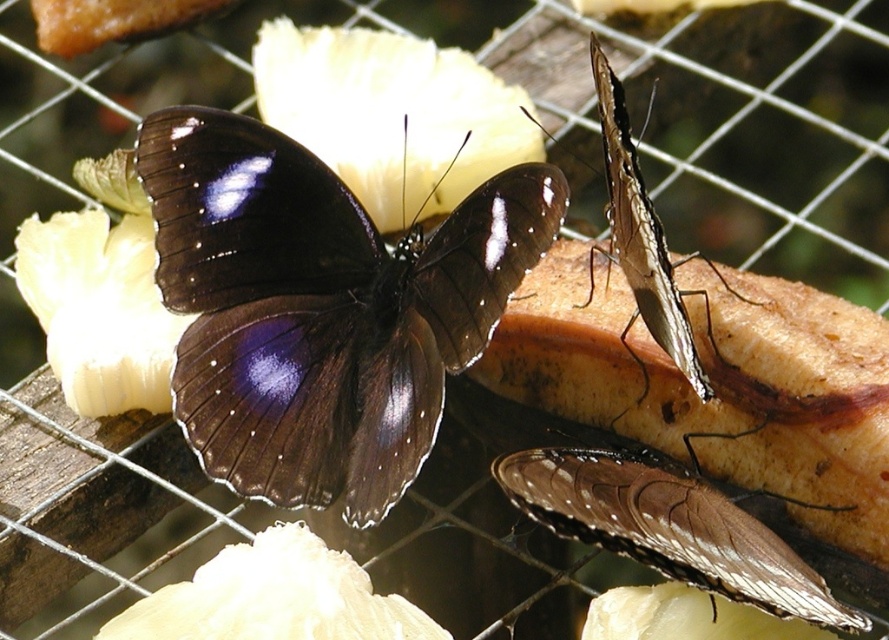
Question: Can you confirm if matte brown wing at center is bigger than shiny brown butterfly at upper right?

Choices:
 (A) no
 (B) yes

Answer: (A)

Question: Estimate the real-world distances between objects in this image. Which object is closer to the matte brown wing at center?

Choices:
 (A) shiny brown butterfly at upper right
 (B) matte black butterfly at center

Answer: (A)

Question: Which point is farther to the camera?

Choices:
 (A) matte brown wing at center
 (B) shiny brown butterfly at upper right
 (C) matte black butterfly at center

Answer: (C)

Question: Which point is farther to the camera?

Choices:
 (A) shiny brown butterfly at upper right
 (B) matte brown wing at center
 (C) matte black butterfly at center

Answer: (C)

Question: Is matte black butterfly at center behind matte brown wing at center?

Choices:
 (A) yes
 (B) no

Answer: (A)

Question: Is matte black butterfly at center wider than matte brown wing at center?

Choices:
 (A) yes
 (B) no

Answer: (A)